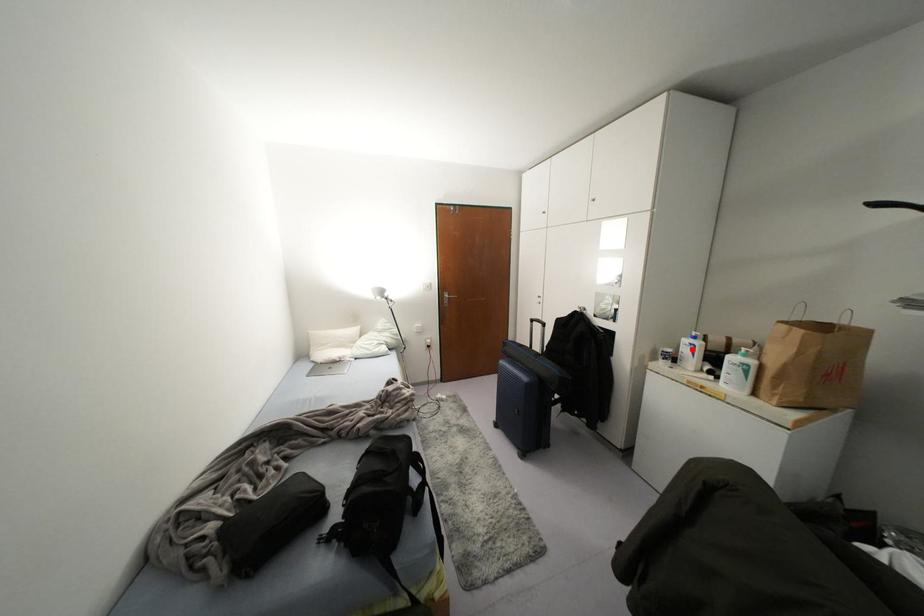
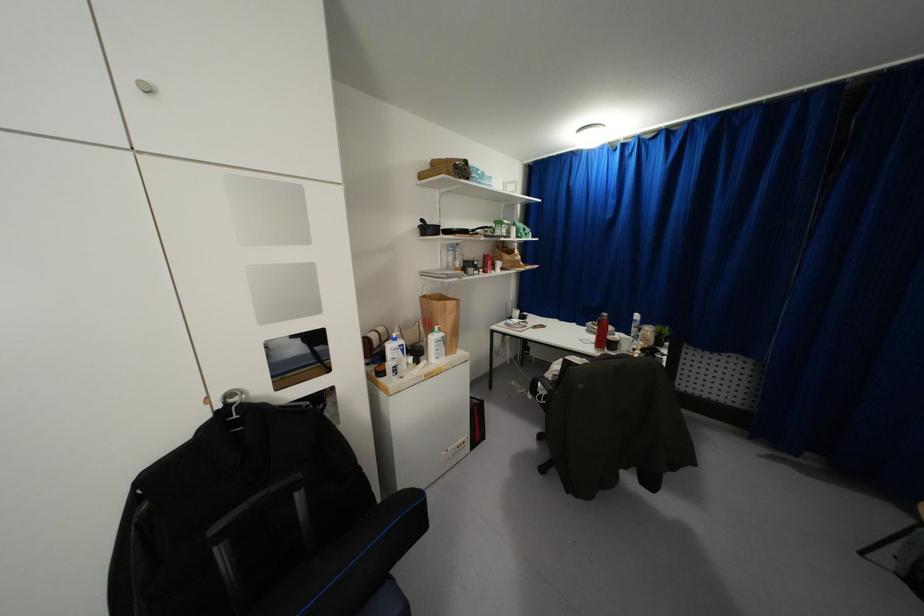
In the second image, find the point that corresponds to the highlighted location in the first image.

(402, 350)